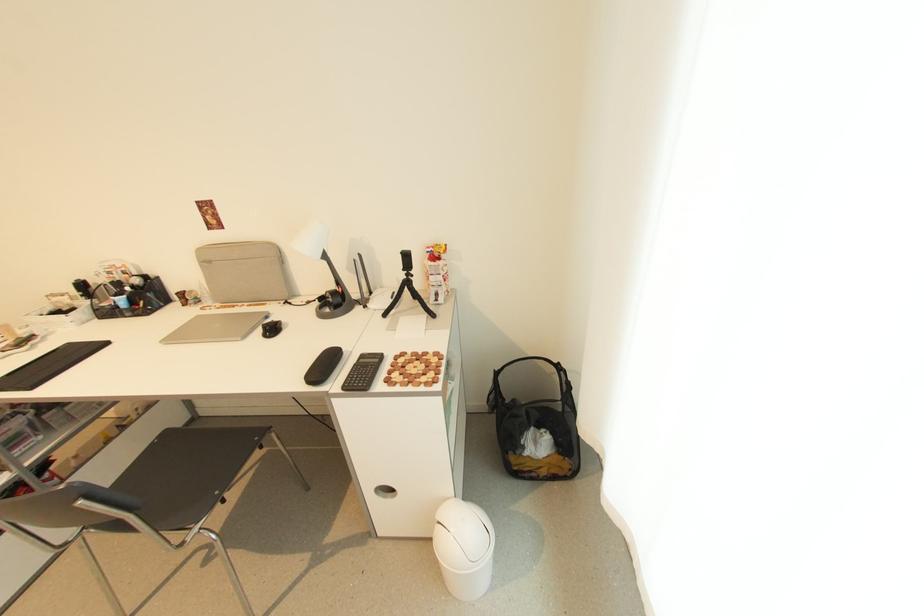
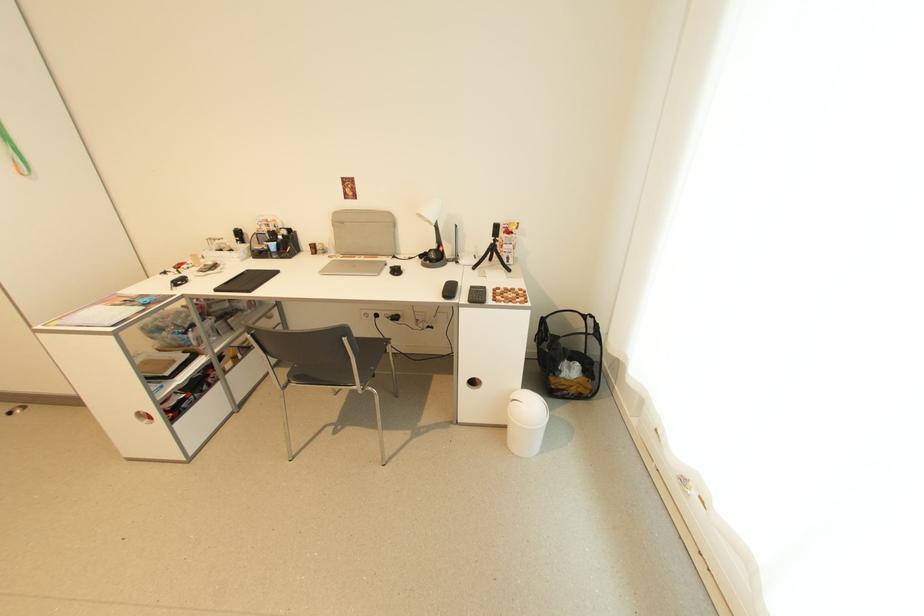
Locate, in the second image, the point that corresponds to point 348,390 in the first image.

(473, 302)